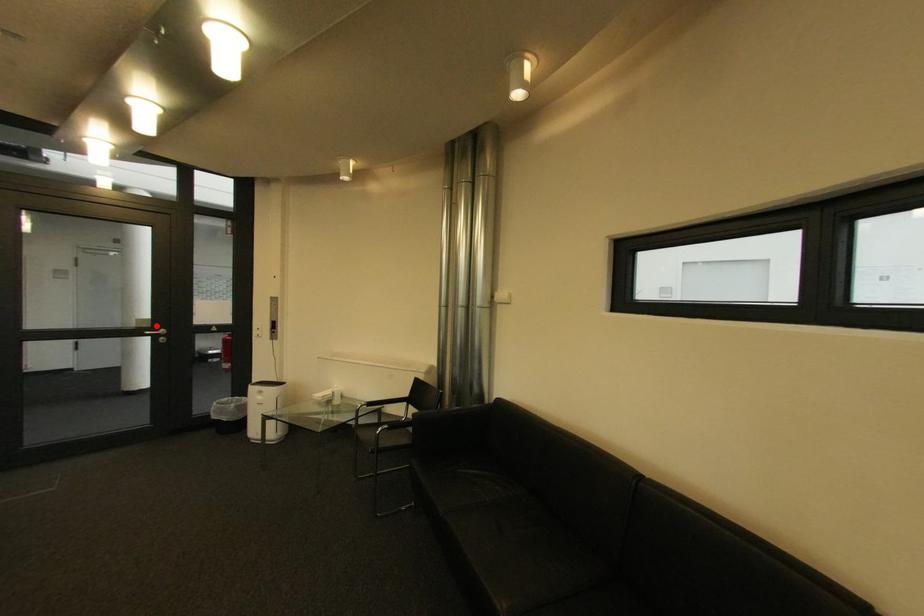
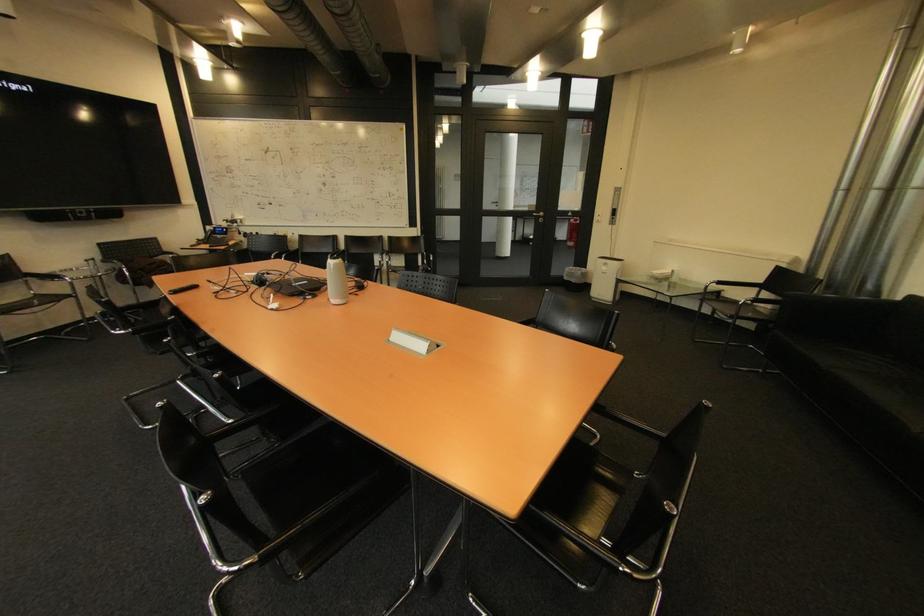
In the second image, find the point that corresponds to the highlighted location in the first image.

(542, 209)